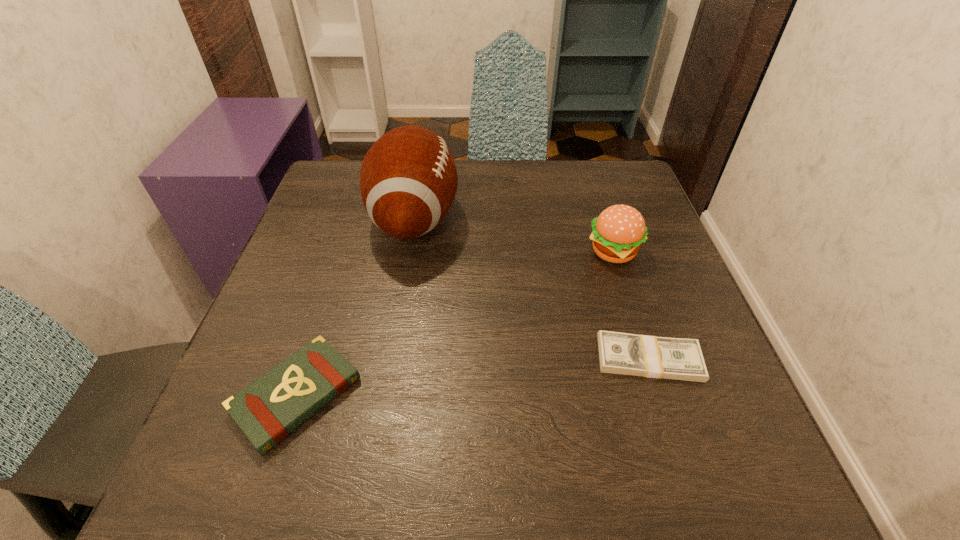
Find the location of a particular element. This screenshot has height=540, width=960. the tallest object is located at coordinates (408, 180).

At what (x,y) coordinates should I click in order to perform the action: click on the second tallest object. Please return your answer as a coordinate pair (x, y). The width and height of the screenshot is (960, 540). Looking at the image, I should click on (617, 233).

Locate an element on the screen. The height and width of the screenshot is (540, 960). the third tallest object is located at coordinates (267, 410).

I want to click on the shortest object, so click(x=619, y=353).

You are a GUI agent. You are given a task and a screenshot of the screen. Output one action in this format:
    pyautogui.click(x=<x>, y=<y>)
    Task: Click on the free space located on the laces of the tallest object
    The width and height of the screenshot is (960, 540).
    Given the screenshot: What is the action you would take?
    pyautogui.click(x=553, y=219)

Where is `vacant area situated on the front of the second tallest object`? This screenshot has width=960, height=540. vacant area situated on the front of the second tallest object is located at coordinates (671, 427).

The width and height of the screenshot is (960, 540). Find the location of `vacant position located 0.330m on the right of the second shortest object`. vacant position located 0.330m on the right of the second shortest object is located at coordinates (564, 395).

Find the location of a particular element. vacant area situated on the back of the shortest object is located at coordinates (631, 303).

The image size is (960, 540). Find the location of `object that is at the far edge`. object that is at the far edge is located at coordinates tap(408, 180).

Image resolution: width=960 pixels, height=540 pixels. Identify the location of object that is at the near edge. (267, 410).